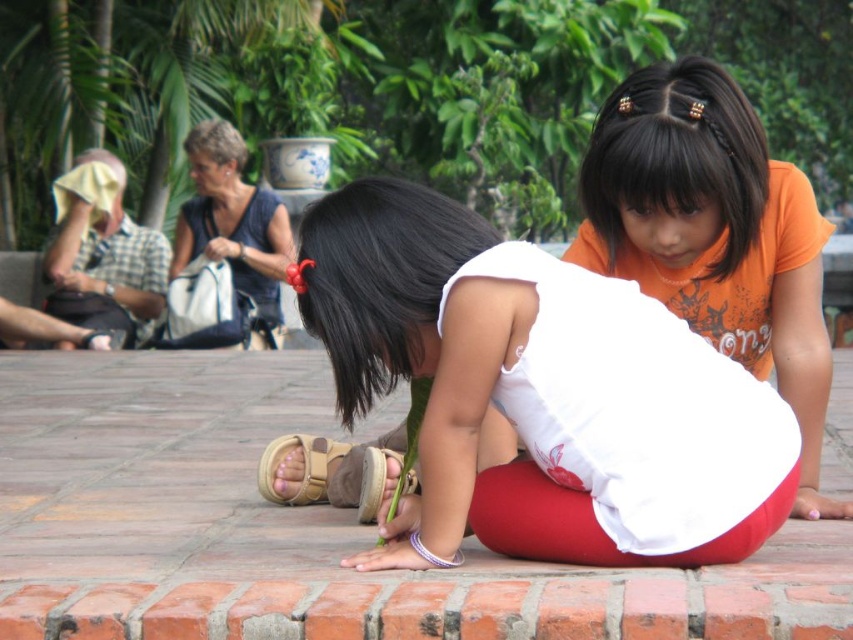
Is blue fabric purse at upper left closer to camera compared to tan suede sandal at lower center?

No, blue fabric purse at upper left is further to the viewer.

Can you confirm if blue fabric purse at upper left is positioned to the left of tan suede sandal at lower center?

Yes, blue fabric purse at upper left is to the left of tan suede sandal at lower center.

This screenshot has width=853, height=640. I want to click on blue fabric purse at upper left, so click(x=231, y=230).

Find the location of a particular element. This screenshot has width=853, height=640. blue fabric purse at upper left is located at coordinates (231, 230).

Looking at this image, which is below, blue fabric purse at upper left or short blond hair at upper left?

blue fabric purse at upper left is below.

Between blue fabric purse at upper left and short blond hair at upper left, which one has less height?

short blond hair at upper left is shorter.

Is point (178, 243) positioned before point (219, 164)?

No, (178, 243) is further to viewer.

Where is `blue fabric purse at upper left`? blue fabric purse at upper left is located at coordinates (231, 230).

Based on the photo, between black silky hair at upper center and blue fabric purse at upper left, which one is positioned higher?

blue fabric purse at upper left is higher up.

Between black silky hair at upper center and blue fabric purse at upper left, which one has more height?

blue fabric purse at upper left is taller.

What do you see at coordinates (677, 156) in the screenshot? I see `black silky hair at upper center` at bounding box center [677, 156].

Where is `black silky hair at upper center`? black silky hair at upper center is located at coordinates (677, 156).